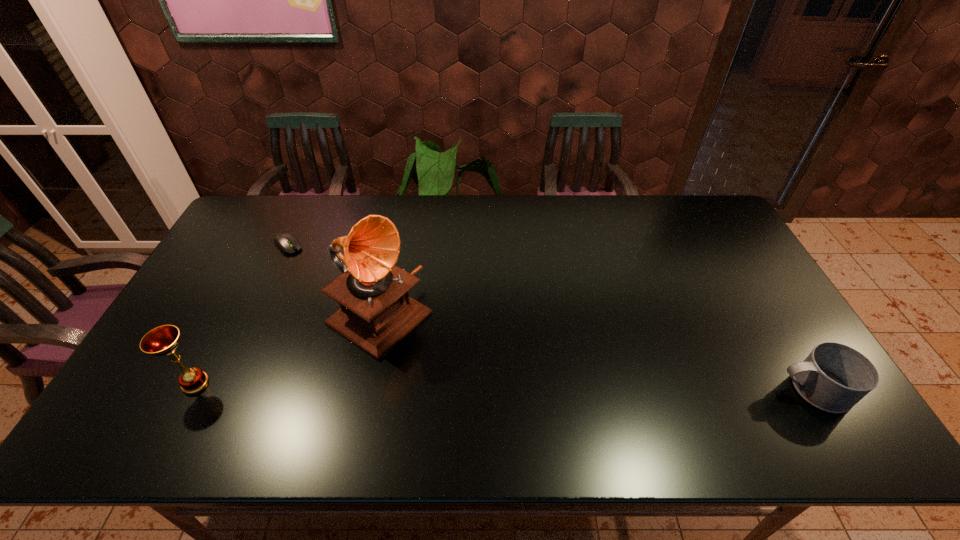
At what (x,y) coordinates should I click in order to perform the action: click on object that is at the left edge. Please return your answer as a coordinate pair (x, y). The height and width of the screenshot is (540, 960). Looking at the image, I should click on (163, 340).

Identify the location of object that is at the right edge. Image resolution: width=960 pixels, height=540 pixels. (834, 377).

Locate an element on the screen. This screenshot has width=960, height=540. object present at the near left corner is located at coordinates (163, 340).

You are a GUI agent. You are given a task and a screenshot of the screen. Output one action in this format:
    pyautogui.click(x=<x>, y=<y>)
    Task: Click on the object located in the near right corner section of the desktop
    The image size is (960, 540).
    Given the screenshot: What is the action you would take?
    pyautogui.click(x=834, y=377)

At what (x,y) coordinates should I click in order to perform the action: click on vacant region at the far edge of the desktop. Please return your answer as a coordinate pair (x, y). The width and height of the screenshot is (960, 540). Looking at the image, I should click on (541, 205).

In the image, there is a desktop. Identify the location of vacant space at the near edge. The height and width of the screenshot is (540, 960). (636, 398).

The width and height of the screenshot is (960, 540). In the image, there is a desktop. Find the location of `free region at the right edge`. free region at the right edge is located at coordinates (768, 355).

I want to click on vacant space at the far left corner of the desktop, so click(256, 227).

Find the location of a particular element. Image resolution: width=960 pixels, height=540 pixels. free space at the far right corner of the desktop is located at coordinates (671, 207).

At what (x,y) coordinates should I click in order to perform the action: click on vacant region at the near right corner. Please return your answer as a coordinate pair (x, y). The width and height of the screenshot is (960, 540). Looking at the image, I should click on (790, 401).